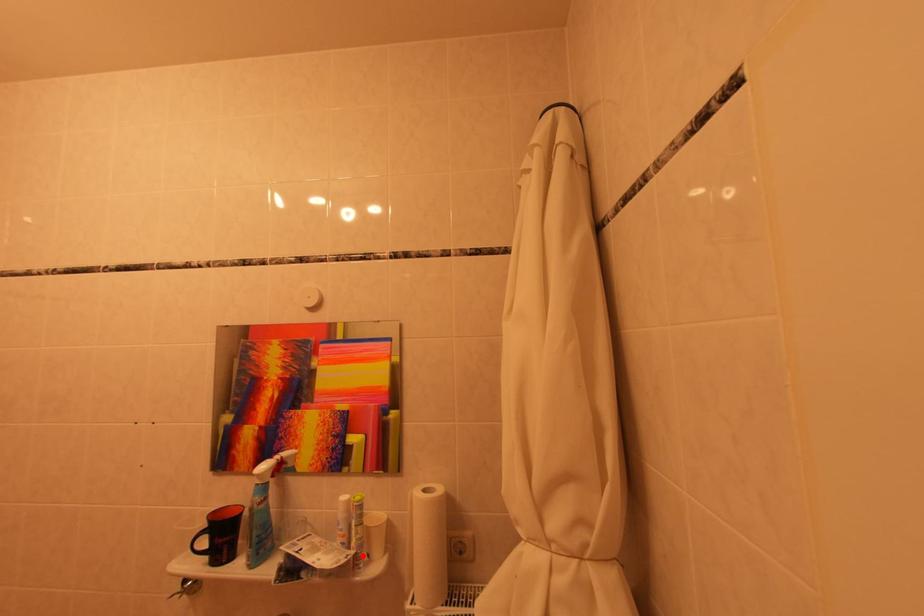
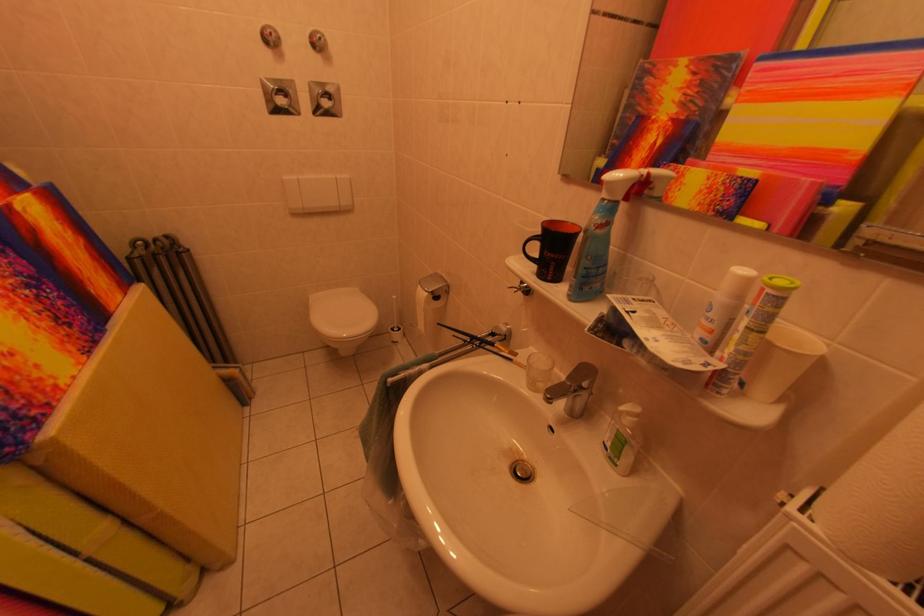
Find the pixel in the second image that matches the highlighted location in the first image.

(732, 370)